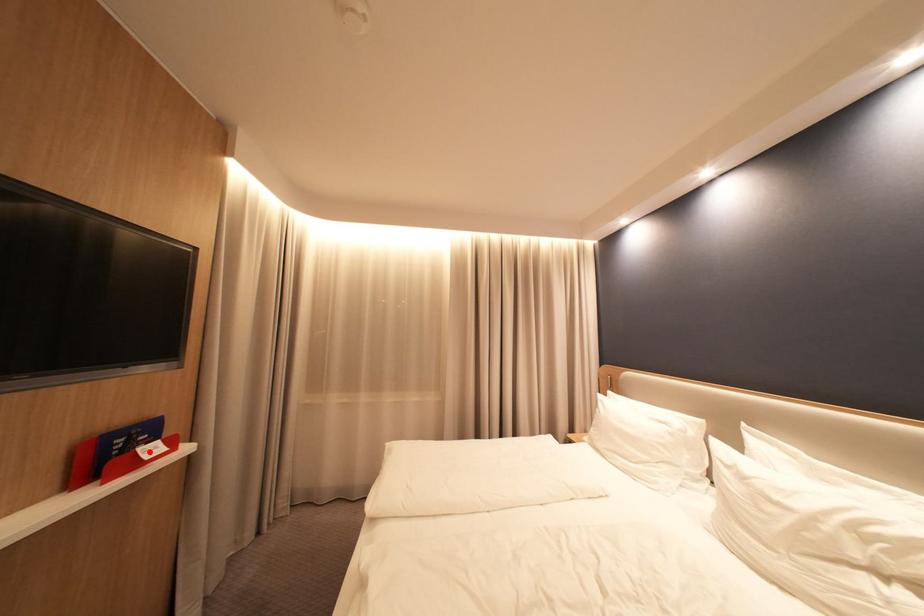
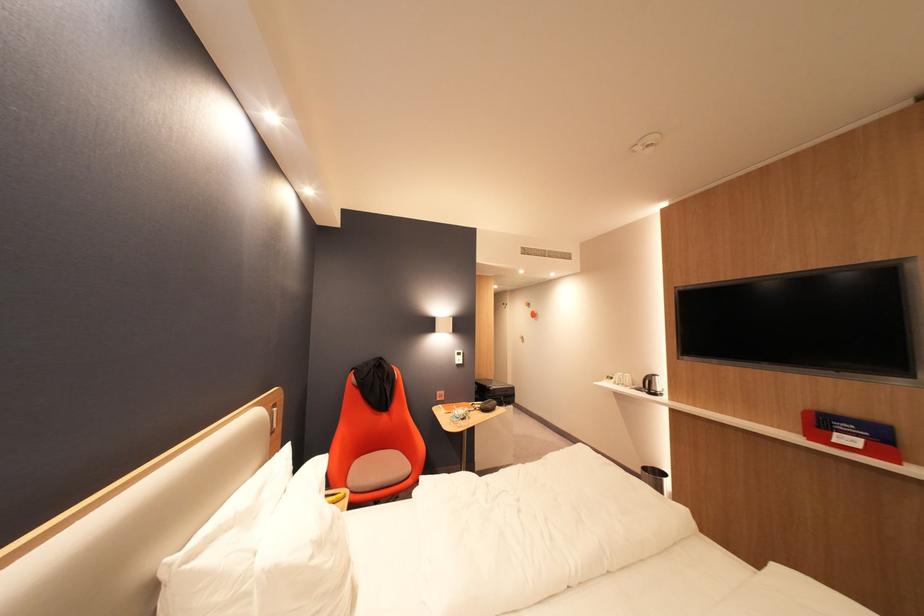
Locate, in the second image, the point that corresponds to the highlighted location in the first image.

(846, 435)